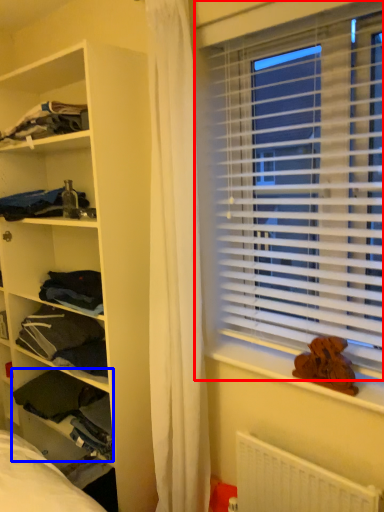
Question: Which object appears closest to the camera in this image, window blind (highlighted by a red box) or clothing (highlighted by a blue box)?

Choices:
 (A) window blind
 (B) clothing

Answer: (A)